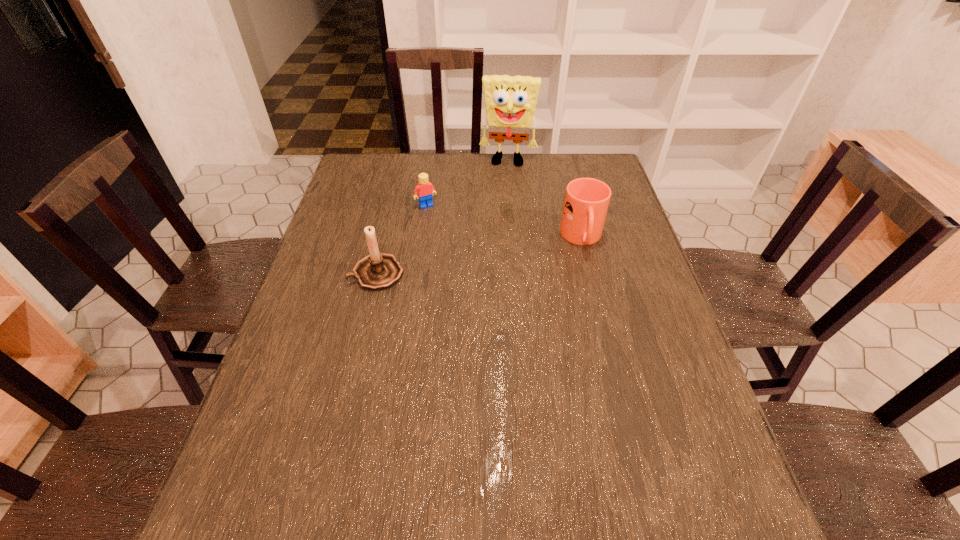
In order to click on vacant space in between the rightmost object and the candle holder in this screenshot , I will do `click(479, 256)`.

Where is `free space between the candle holder and the shortest object`? The width and height of the screenshot is (960, 540). free space between the candle holder and the shortest object is located at coordinates (401, 240).

Image resolution: width=960 pixels, height=540 pixels. In order to click on vacant region between the rightmost object and the sponge in this screenshot , I will do `click(545, 200)`.

This screenshot has height=540, width=960. What are the coordinates of `vacant area between the Lego and the sponge` in the screenshot? It's located at (468, 184).

Choose which object is the nearest neighbor to the tallest object. Please provide its 2D coordinates. Your answer should be formatted as a tuple, i.e. [(x, y)], where the tuple contains the x and y coordinates of a point satisfying the conditions above.

[(424, 189)]

The width and height of the screenshot is (960, 540). Identify the location of the third closest object to the mug. (378, 271).

Find the location of a particular element. free spot that satisfies the following two spatial constraints: 1. on the back side of the sponge; 2. on the right side of the candle holder is located at coordinates (403, 162).